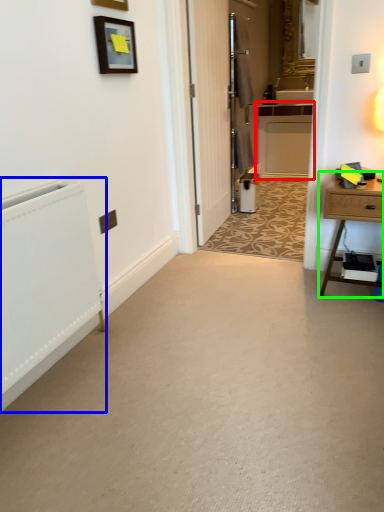
Question: Based on their relative distances, which object is nearer to cabinetry (highlighted by a red box)? Choose from radiator (highlighted by a blue box) and nightstand (highlighted by a green box).

Choices:
 (A) radiator
 (B) nightstand

Answer: (B)